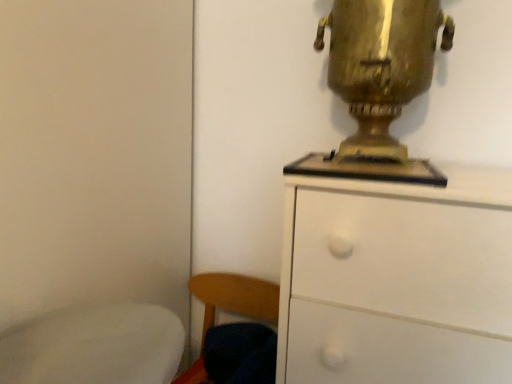
Question: Is wooden chair at lower left shorter than white matte chest of drawers at upper right?

Choices:
 (A) yes
 (B) no

Answer: (A)

Question: From a real-world perspective, is wooden chair at lower left beneath white matte chest of drawers at upper right?

Choices:
 (A) yes
 (B) no

Answer: (A)

Question: Is wooden chair at lower left far away from white matte chest of drawers at upper right?

Choices:
 (A) yes
 (B) no

Answer: (B)

Question: Could white matte chest of drawers at upper right be considered to be inside wooden chair at lower left?

Choices:
 (A) yes
 (B) no

Answer: (B)

Question: Does wooden chair at lower left have a greater height compared to white matte chest of drawers at upper right?

Choices:
 (A) yes
 (B) no

Answer: (B)

Question: Is gold metallic samovar at upper right to the left or to the right of wooden chair at lower left in the image?

Choices:
 (A) left
 (B) right

Answer: (B)

Question: Is point (358, 54) positioned closer to the camera than point (252, 306)?

Choices:
 (A) farther
 (B) closer

Answer: (B)

Question: From the image's perspective, relative to wooden chair at lower left, is gold metallic samovar at upper right above or below?

Choices:
 (A) above
 (B) below

Answer: (A)

Question: Considering the positions of gold metallic samovar at upper right and wooden chair at lower left in the image, is gold metallic samovar at upper right taller or shorter than wooden chair at lower left?

Choices:
 (A) short
 (B) tall

Answer: (B)

Question: Looking at the image, does white matte chest of drawers at upper right seem bigger or smaller compared to wooden chair at lower left?

Choices:
 (A) small
 (B) big

Answer: (B)

Question: Would you say white matte chest of drawers at upper right is to the left or to the right of wooden chair at lower left in the picture?

Choices:
 (A) right
 (B) left

Answer: (A)

Question: Considering their positions, is white matte chest of drawers at upper right located in front of or behind wooden chair at lower left?

Choices:
 (A) behind
 (B) front

Answer: (B)

Question: Is white matte chest of drawers at upper right taller or shorter than wooden chair at lower left?

Choices:
 (A) tall
 (B) short

Answer: (A)

Question: From the image's perspective, relative to gold metallic samovar at upper right, is white matte chest of drawers at upper right above or below?

Choices:
 (A) above
 (B) below

Answer: (B)

Question: Considering the positions of white matte chest of drawers at upper right and gold metallic samovar at upper right in the image, is white matte chest of drawers at upper right bigger or smaller than gold metallic samovar at upper right?

Choices:
 (A) small
 (B) big

Answer: (B)